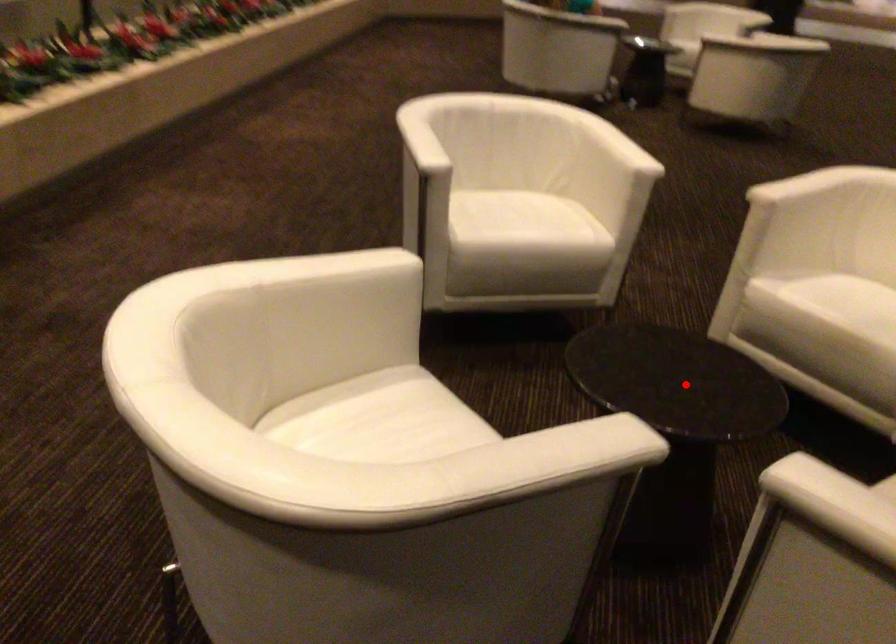
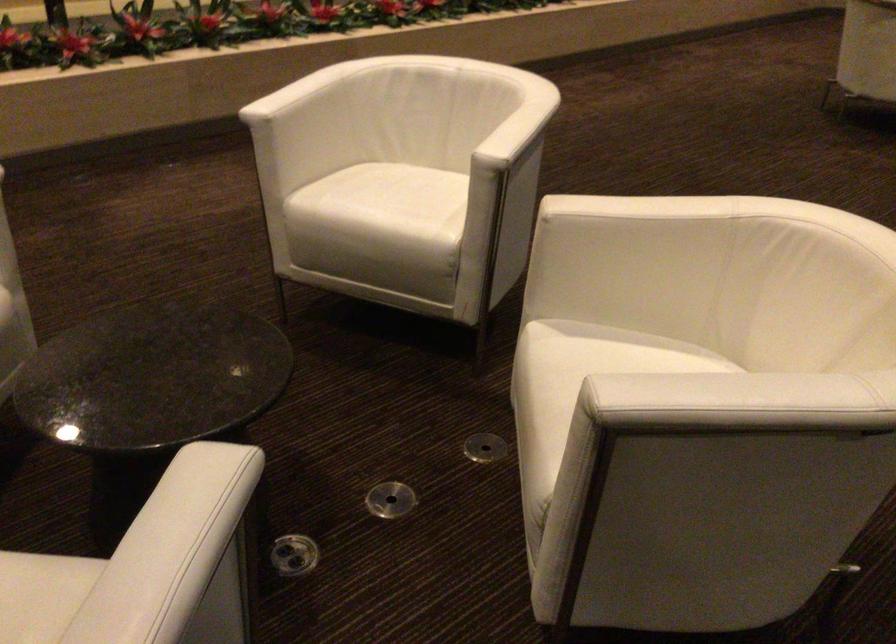
Question: I am providing you with two images of the same scene from different viewpoints. Given a red point in image1, look at the same physical point in image2. Is it:

Choices:
 (A) Closer to the viewpoint
 (B) Farther from the viewpoint

Answer: (A)